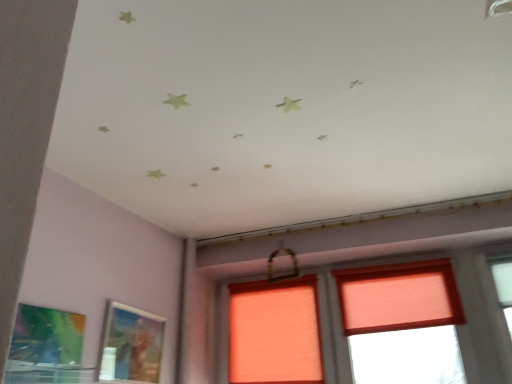
Describe the element at coordinates (131, 345) in the screenshot. I see `metallic silver picture frame at lower left, positioned as the 2th picture frame in left-to-right order` at that location.

What is the approximate height of orange fabric window at center?

It is 25.28 inches.

What do you see at coordinates (46, 346) in the screenshot? I see `matte green painting at lower left, the first picture frame in the front-to-back sequence` at bounding box center [46, 346].

Locate an element on the screen. The height and width of the screenshot is (384, 512). metallic silver picture frame at lower left, marked as the first picture frame in a right-to-left arrangement is located at coordinates (131, 345).

There is a orange fabric window at center. Where is `the 1st picture frame below it (from a real-world perspective)`? the 1st picture frame below it (from a real-world perspective) is located at coordinates (131, 345).

Does orange fabric window at center have a greater width compared to metallic silver picture frame at lower left, which ranks as the 2th picture frame in front-to-back order?

Yes.

Can you tell me how much matte green painting at lower left, the first picture frame positioned from the left, and orange fabric window at center differ in facing direction?

They differ by 89.6 degrees in their facing directions.

Between point (61, 323) and point (367, 318), which one is positioned behind?

The point (367, 318) is behind.

Choose the correct answer: Is matte green painting at lower left, the first picture frame in the front-to-back sequence, inside orange fabric window at center or outside it?

matte green painting at lower left, the first picture frame in the front-to-back sequence, is located beyond the bounds of orange fabric window at center.

Is matte green painting at lower left, the first picture frame positioned from the left, positioned with its back to orange fabric window at center?

That's not correct — matte green painting at lower left, the first picture frame positioned from the left, is not looking away from orange fabric window at center.

Is metallic silver picture frame at lower left, which ranks as the 2th picture frame in front-to-back order, positioned before orange fabric window at center?

Yes, metallic silver picture frame at lower left, which ranks as the 2th picture frame in front-to-back order, is in front of orange fabric window at center.

Is metallic silver picture frame at lower left, positioned as the 2th picture frame in left-to-right order, in contact with orange fabric window at center?

metallic silver picture frame at lower left, positioned as the 2th picture frame in left-to-right order, and orange fabric window at center are not in contact.

Based on the photo, from their relative heights in the image, would you say metallic silver picture frame at lower left, positioned as the 2th picture frame in left-to-right order, is taller or shorter than orange fabric window at center?

Considering their sizes, metallic silver picture frame at lower left, positioned as the 2th picture frame in left-to-right order, has less height than orange fabric window at center.

Looking at their sizes, would you say metallic silver picture frame at lower left, which ranks as the 2th picture frame in front-to-back order, is wider or thinner than orange fabric window at center?

Clearly, metallic silver picture frame at lower left, which ranks as the 2th picture frame in front-to-back order, has less width compared to orange fabric window at center.

Which is in front, orange fabric window at center or matte green painting at lower left, the first picture frame in the front-to-back sequence?

Positioned in front is matte green painting at lower left, the first picture frame in the front-to-back sequence.

Considering the positions of points (339, 360) and (65, 359), is point (339, 360) closer to camera compared to point (65, 359)?

No.

Between orange fabric window at center and matte green painting at lower left, which ranks as the 2th picture frame in back-to-front order, which one appears on the right side from the viewer's perspective?

Positioned to the right is orange fabric window at center.

From the image's perspective, which object appears higher, orange fabric window at center or matte green painting at lower left, the first picture frame in the front-to-back sequence?

matte green painting at lower left, the first picture frame in the front-to-back sequence.

Can you confirm if matte green painting at lower left, the first picture frame positioned from the left, is smaller than metallic silver picture frame at lower left, marked as the first picture frame in a right-to-left arrangement?

Indeed, matte green painting at lower left, the first picture frame positioned from the left, has a smaller size compared to metallic silver picture frame at lower left, marked as the first picture frame in a right-to-left arrangement.

Which is behind, point (62, 323) or point (160, 338)?

The point (160, 338) is behind.

Are matte green painting at lower left, which is the 2th picture frame from right to left, and metallic silver picture frame at lower left, marked as the first picture frame in a right-to-left arrangement, beside each other?

matte green painting at lower left, which is the 2th picture frame from right to left, and metallic silver picture frame at lower left, marked as the first picture frame in a right-to-left arrangement, are not in contact.

Where is `picture frame that appears in front of the metallic silver picture frame at lower left, positioned as the 2th picture frame in left-to-right order`? This screenshot has width=512, height=384. picture frame that appears in front of the metallic silver picture frame at lower left, positioned as the 2th picture frame in left-to-right order is located at coordinates (46, 346).

Which object is wider, metallic silver picture frame at lower left, which ranks as the 2th picture frame in front-to-back order, or matte green painting at lower left, the first picture frame in the front-to-back sequence?

metallic silver picture frame at lower left, which ranks as the 2th picture frame in front-to-back order.

Which object is further away from the camera taking this photo, metallic silver picture frame at lower left, marked as the first picture frame in a right-to-left arrangement, or matte green painting at lower left, the first picture frame positioned from the left?

metallic silver picture frame at lower left, marked as the first picture frame in a right-to-left arrangement, is more distant.

Identify the location of picture frame that is the 1st one when counting upward from the orange fabric window at center (from the image's perspective). (131, 345).

Where is `the 2nd picture frame located beneath the orange fabric window at center (from a real-world perspective)`? This screenshot has width=512, height=384. the 2nd picture frame located beneath the orange fabric window at center (from a real-world perspective) is located at coordinates (46, 346).

Looking at the image, which one is located closer to metallic silver picture frame at lower left, positioned as the 2th picture frame in left-to-right order, orange fabric window at center or matte green painting at lower left, the first picture frame positioned from the left?

matte green painting at lower left, the first picture frame positioned from the left.

Looking at the image, which one is located further to orange fabric window at center, matte green painting at lower left, the first picture frame in the front-to-back sequence, or metallic silver picture frame at lower left, marked as the first picture frame in a back-to-front arrangement?

matte green painting at lower left, the first picture frame in the front-to-back sequence, is positioned further to the anchor orange fabric window at center.

Considering their positions, is matte green painting at lower left, the first picture frame in the front-to-back sequence, positioned further to metallic silver picture frame at lower left, marked as the first picture frame in a back-to-front arrangement, than orange fabric window at center?

Among the two, orange fabric window at center is located further to metallic silver picture frame at lower left, marked as the first picture frame in a back-to-front arrangement.

From the image, which object appears to be nearer to orange fabric window at center, metallic silver picture frame at lower left, positioned as the 2th picture frame in left-to-right order, or matte green painting at lower left, which ranks as the 2th picture frame in back-to-front order?

metallic silver picture frame at lower left, positioned as the 2th picture frame in left-to-right order, is positioned closer to the anchor orange fabric window at center.

When comparing their distances from matte green painting at lower left, the first picture frame positioned from the left, does metallic silver picture frame at lower left, marked as the first picture frame in a back-to-front arrangement, or orange fabric window at center seem closer?

metallic silver picture frame at lower left, marked as the first picture frame in a back-to-front arrangement, is closer to matte green painting at lower left, the first picture frame positioned from the left.

Considering their positions, is orange fabric window at center positioned further to matte green painting at lower left, the first picture frame in the front-to-back sequence, than metallic silver picture frame at lower left, which ranks as the 2th picture frame in front-to-back order?

orange fabric window at center lies further to matte green painting at lower left, the first picture frame in the front-to-back sequence, than the other object.

Find the location of a particular element. Image resolution: width=512 pixels, height=384 pixels. picture frame between matte green painting at lower left, the first picture frame in the front-to-back sequence, and orange fabric window at center is located at coordinates (131, 345).